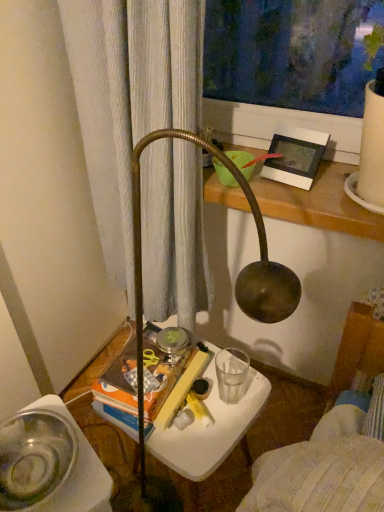
Where is `blank space situated above white plastic table at center (from a real-world perspective)`? This screenshot has height=512, width=384. blank space situated above white plastic table at center (from a real-world perspective) is located at coordinates (210, 401).